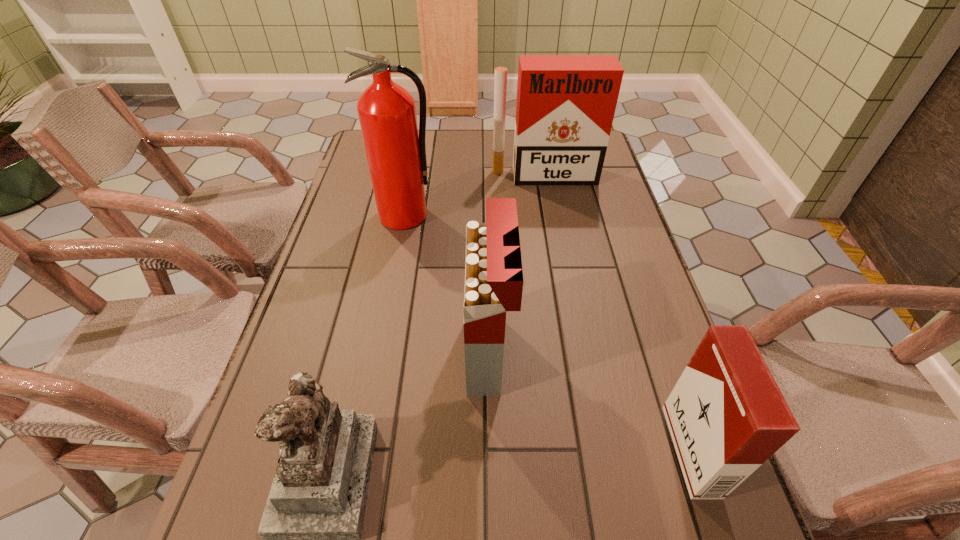
Identify the location of vacant area between the tallest object and the third farthest object. The width and height of the screenshot is (960, 540). (446, 284).

You are a GUI agent. You are given a task and a screenshot of the screen. Output one action in this format:
    pyautogui.click(x=<x>, y=<y>)
    Task: Click on the unoccupied area between the nearest cigarette_case and the second farthest object
    This screenshot has width=960, height=540.
    Given the screenshot: What is the action you would take?
    pyautogui.click(x=548, y=333)

Locate an element on the screen. This screenshot has height=540, width=960. free area in between the farthest object and the nearest cigarette_case is located at coordinates (617, 313).

Identify which object is located as the fourth nearest to the third farthest object. Please provide its 2D coordinates. Your answer should be formatted as a tuple, i.e. [(x, y)], where the tuple contains the x and y coordinates of a point satisfying the conditions above.

[(565, 106)]

What are the coordinates of `object identified as the closest to the third farthest object` in the screenshot? It's located at (312, 523).

The height and width of the screenshot is (540, 960). I want to click on cigarette_case that is the closest to the figurine, so click(x=494, y=281).

Locate an element on the screen. Image resolution: width=960 pixels, height=540 pixels. cigarette_case that can be found as the second closest to the farthest cigarette_case is located at coordinates (726, 415).